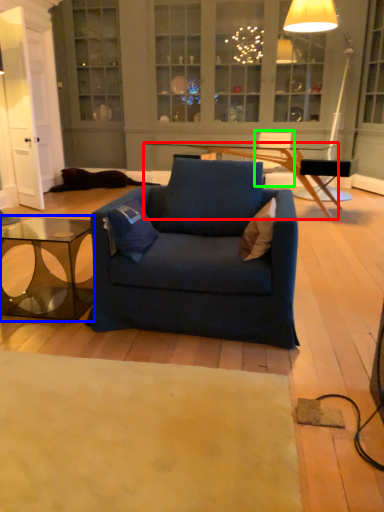
Question: Which object is positioned closest to desk (highlighted by a red box)? Select from coffee table (highlighted by a blue box) and armchair (highlighted by a green box).

Choices:
 (A) coffee table
 (B) armchair

Answer: (B)